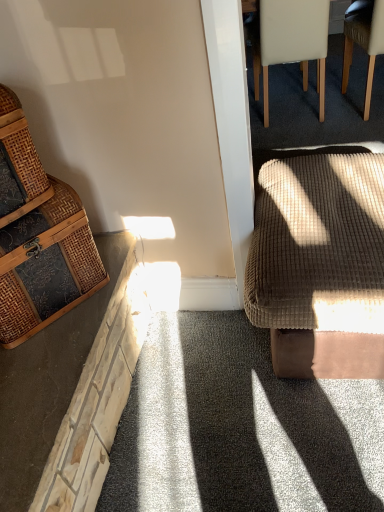
Question: Is woven brown basket at left spatially inside brown fabric chair at upper right, marked as the second chair in a bottom-to-top arrangement, or outside of it?

Choices:
 (A) outside
 (B) inside

Answer: (A)

Question: Is woven brown basket at left to the left or to the right of brown fabric chair at upper right, which is the first chair in right-to-left order, in the image?

Choices:
 (A) right
 (B) left

Answer: (B)

Question: Which of these objects is positioned farthest from the woven brown basket at left?

Choices:
 (A) velvet brown footstool at right
 (B) white leather chair at upper right, acting as the 3th chair starting from the front
 (C) brown fabric chair at upper right, arranged as the third chair when viewed from the left
 (D) woven rattan chest at left, acting as the 3th chair starting from the back

Answer: (C)

Question: Estimate the real-world distances between objects in this image. Which object is closer to the velvet brown footstool at right?

Choices:
 (A) woven rattan chest at left, acting as the third chair starting from the right
 (B) brown fabric chair at upper right, arranged as the third chair when viewed from the left
 (C) white leather chair at upper right, which is counted as the second chair, starting from the right
 (D) woven brown basket at left

Answer: (A)